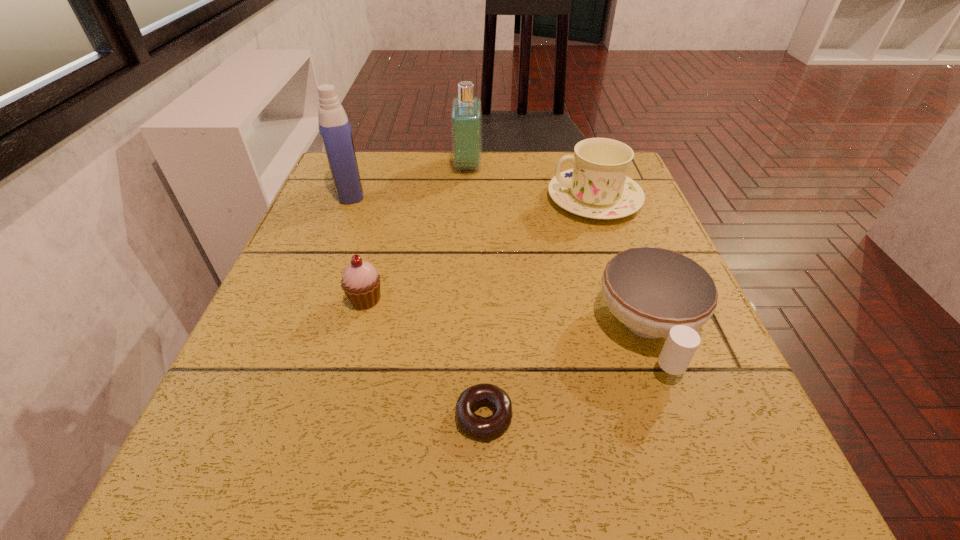
You are a GUI agent. You are given a task and a screenshot of the screen. Output one action in this format:
    pyautogui.click(x=<x>, y=<y>)
    Task: Click on the detergent that is at the left edge
    This screenshot has height=540, width=960.
    Given the screenshot: What is the action you would take?
    pyautogui.click(x=334, y=126)

Find the location of a particular element. The height and width of the screenshot is (540, 960). cupcake that is at the left edge is located at coordinates (360, 282).

Where is `object that is at the far left corner`? This screenshot has height=540, width=960. object that is at the far left corner is located at coordinates (334, 126).

At what (x,y) coordinates should I click in order to perform the action: click on object that is at the far right corner. Please return your answer as a coordinate pair (x, y). Looking at the image, I should click on click(597, 187).

This screenshot has width=960, height=540. In the image, there is a desktop. In order to click on vacant area at the far edge in this screenshot , I will do `click(555, 154)`.

Locate an element on the screen. Image resolution: width=960 pixels, height=540 pixels. vacant position at the left edge of the desktop is located at coordinates (365, 234).

Image resolution: width=960 pixels, height=540 pixels. Find the location of `vacant space at the right edge`. vacant space at the right edge is located at coordinates (738, 387).

The width and height of the screenshot is (960, 540). Find the location of `vacant space at the far left corner`. vacant space at the far left corner is located at coordinates (372, 159).

The height and width of the screenshot is (540, 960). I want to click on free space at the near left corner of the desktop, so click(x=193, y=516).

You are a GUI agent. You are given a task and a screenshot of the screen. Output one action in this format:
    pyautogui.click(x=<x>, y=<y>)
    Task: Click on the blank space at the near right corner of the desktop
    The image size is (960, 540).
    Given the screenshot: What is the action you would take?
    pyautogui.click(x=750, y=449)